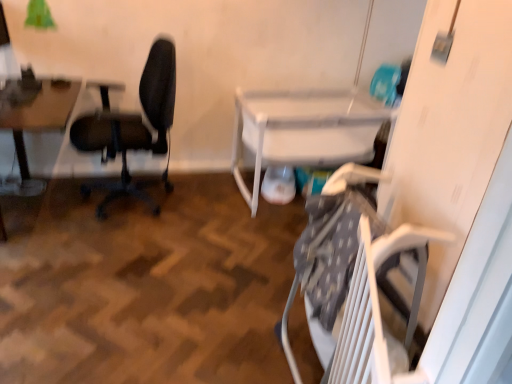
Measure the distance between point (286,143) and camera.

Point (286,143) is 2.84 meters away from camera.

The image size is (512, 384). Find the location of `white plastic table at lower right, which appears as the 2th table when viewed from the left`. white plastic table at lower right, which appears as the 2th table when viewed from the left is located at coordinates coord(304,130).

From a real-world perspective, is wooden table at left, arranged as the first table when viewed from the left, above or below white plastic table at lower right, which is counted as the first table, starting from the right?

From a real-world perspective, wooden table at left, arranged as the first table when viewed from the left, is physically above white plastic table at lower right, which is counted as the first table, starting from the right.

Image resolution: width=512 pixels, height=384 pixels. I want to click on table that is behind the wooden table at left, which appears as the 2th table when viewed from the right, so click(304, 130).

Consider the image. Which object is thinner, wooden table at left, arranged as the first table when viewed from the left, or white plastic table at lower right, which appears as the 2th table when viewed from the left?

wooden table at left, arranged as the first table when viewed from the left, is thinner.

Is black matte office chair at left next to white plastic table at lower right, which appears as the 2th table when viewed from the left, and touching it?

black matte office chair at left is not next to white plastic table at lower right, which appears as the 2th table when viewed from the left, and they're not touching.

Can you tell me how much black matte office chair at left and white plastic table at lower right, which is counted as the first table, starting from the right, differ in facing direction?

76 degrees.

Is black matte office chair at left to the left of white plastic table at lower right, which is counted as the first table, starting from the right, from the viewer's perspective?

Correct, you'll find black matte office chair at left to the left of white plastic table at lower right, which is counted as the first table, starting from the right.

From a real-world perspective, is black matte office chair at left physically below white plastic table at lower right, which appears as the 2th table when viewed from the left?

Incorrect, from a real-world perspective, black matte office chair at left is higher than white plastic table at lower right, which appears as the 2th table when viewed from the left.

Would you say wooden table at left, which appears as the 2th table when viewed from the right, is to the left or to the right of black matte office chair at left in the picture?

wooden table at left, which appears as the 2th table when viewed from the right, is to the left of black matte office chair at left.

How distant is wooden table at left, arranged as the first table when viewed from the left, from black matte office chair at left?

A distance of 15.97 inches exists between wooden table at left, arranged as the first table when viewed from the left, and black matte office chair at left.

At what (x,y) coordinates should I click in order to perform the action: click on chair in front of the wooden table at left, arranged as the first table when viewed from the left. Please return your answer as a coordinate pair (x, y). This screenshot has height=384, width=512. Looking at the image, I should click on (133, 127).

Is black matte office chair at left completely or partially inside wooden table at left, arranged as the first table when viewed from the left?

No, black matte office chair at left is not surrounded by wooden table at left, arranged as the first table when viewed from the left.

Which object is more forward, black matte office chair at left or wooden table at left, which appears as the 2th table when viewed from the right?

black matte office chair at left.

From the black matte office chair at left, count 1st tables backward and point to it. Please provide its 2D coordinates.

[(37, 126)]

In the scene shown: Does black matte office chair at left contain wooden table at left, which appears as the 2th table when viewed from the right?

No, wooden table at left, which appears as the 2th table when viewed from the right, is located outside of black matte office chair at left.

Can you confirm if black matte office chair at left is smaller than wooden table at left, which appears as the 2th table when viewed from the right?

Actually, black matte office chair at left might be larger than wooden table at left, which appears as the 2th table when viewed from the right.

Is white plastic table at lower right, which appears as the 2th table when viewed from the left, looking in the opposite direction of black matte office chair at left?

No, white plastic table at lower right, which appears as the 2th table when viewed from the left, is not facing the opposite direction of black matte office chair at left.

Image resolution: width=512 pixels, height=384 pixels. Find the location of `table on the right of the black matte office chair at left`. table on the right of the black matte office chair at left is located at coordinates (304, 130).

Which of these two, white plastic table at lower right, which is counted as the first table, starting from the right, or black matte office chair at left, stands taller?

black matte office chair at left.

From the image's perspective, who appears lower, white plastic table at lower right, which appears as the 2th table when viewed from the left, or black matte office chair at left?

white plastic table at lower right, which appears as the 2th table when viewed from the left.

Consider the image. Which point is more forward, [234,102] or [21,150]?

The point [21,150] is in front.

Between white plastic table at lower right, which appears as the 2th table when viewed from the left, and wooden table at left, arranged as the first table when viewed from the left, which one appears on the left side from the viewer's perspective?

From the viewer's perspective, wooden table at left, arranged as the first table when viewed from the left, appears more on the left side.

From a real-world perspective, which is physically above, white plastic table at lower right, which appears as the 2th table when viewed from the left, or wooden table at left, arranged as the first table when viewed from the left?

wooden table at left, arranged as the first table when viewed from the left, from a real-world perspective.

What are the coordinates of `table that appears above the wooden table at left, arranged as the first table when viewed from the left (from the image's perspective)` in the screenshot? It's located at (304, 130).

You are a GUI agent. You are given a task and a screenshot of the screen. Output one action in this format:
    pyautogui.click(x=<x>, y=<y>)
    Task: Click on the chair on the left of white plastic table at lower right, which is counted as the first table, starting from the right
    The height and width of the screenshot is (384, 512).
    Given the screenshot: What is the action you would take?
    pyautogui.click(x=133, y=127)

When comparing their distances from black matte office chair at left, does wooden table at left, which appears as the 2th table when viewed from the right, or white plastic table at lower right, which is counted as the first table, starting from the right, seem further?

white plastic table at lower right, which is counted as the first table, starting from the right, is further to black matte office chair at left.

From the image, which object appears to be farther from wooden table at left, which appears as the 2th table when viewed from the right, white plastic table at lower right, which appears as the 2th table when viewed from the left, or black matte office chair at left?

The object further to wooden table at left, which appears as the 2th table when viewed from the right, is white plastic table at lower right, which appears as the 2th table when viewed from the left.

Looking at the image, which one is located further to white plastic table at lower right, which is counted as the first table, starting from the right, wooden table at left, arranged as the first table when viewed from the left, or black matte office chair at left?

wooden table at left, arranged as the first table when viewed from the left, is positioned further to the anchor white plastic table at lower right, which is counted as the first table, starting from the right.

Considering their positions, is black matte office chair at left positioned further to white plastic table at lower right, which is counted as the first table, starting from the right, than wooden table at left, which appears as the 2th table when viewed from the right?

wooden table at left, which appears as the 2th table when viewed from the right, is further to white plastic table at lower right, which is counted as the first table, starting from the right.

From the image, which object appears to be nearer to black matte office chair at left, white plastic table at lower right, which appears as the 2th table when viewed from the left, or wooden table at left, which appears as the 2th table when viewed from the right?

Among the two, wooden table at left, which appears as the 2th table when viewed from the right, is located nearer to black matte office chair at left.

Consider the image. Estimate the real-world distances between objects in this image. Which object is further from wooden table at left, arranged as the first table when viewed from the left, black matte office chair at left or white plastic table at lower right, which appears as the 2th table when viewed from the left?

white plastic table at lower right, which appears as the 2th table when viewed from the left.

At what (x,y) coordinates should I click in order to perform the action: click on chair located between wooden table at left, arranged as the first table when viewed from the left, and white plastic table at lower right, which appears as the 2th table when viewed from the left, in the left-right direction. Please return your answer as a coordinate pair (x, y). The image size is (512, 384). Looking at the image, I should click on (133, 127).